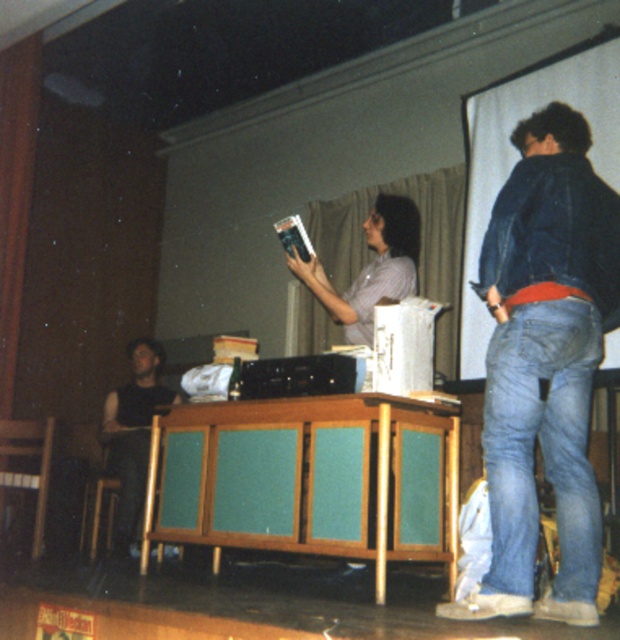
Question: Does matte black book at center have a lesser width compared to black sleeveless shirt at left?

Choices:
 (A) no
 (B) yes

Answer: (A)

Question: Which of these objects is positioned closest to the black sleeveless shirt at left?

Choices:
 (A) woodengreen panelled cabinet at center
 (B) denim jeans at right
 (C) green fabric curtain at upper center
 (D) matte black book at center

Answer: (C)

Question: Does green fabric curtain at upper center appear on the right side of black sleeveless shirt at left?

Choices:
 (A) no
 (B) yes

Answer: (B)

Question: Which object appears closest to the camera in this image?

Choices:
 (A) green fabric curtain at upper center
 (B) black sleeveless shirt at left

Answer: (B)

Question: Which object is farther from the camera taking this photo?

Choices:
 (A) denim jeans at right
 (B) black sleeveless shirt at left

Answer: (B)

Question: Is the position of matte black book at center more distant than that of black sleeveless shirt at left?

Choices:
 (A) no
 (B) yes

Answer: (A)